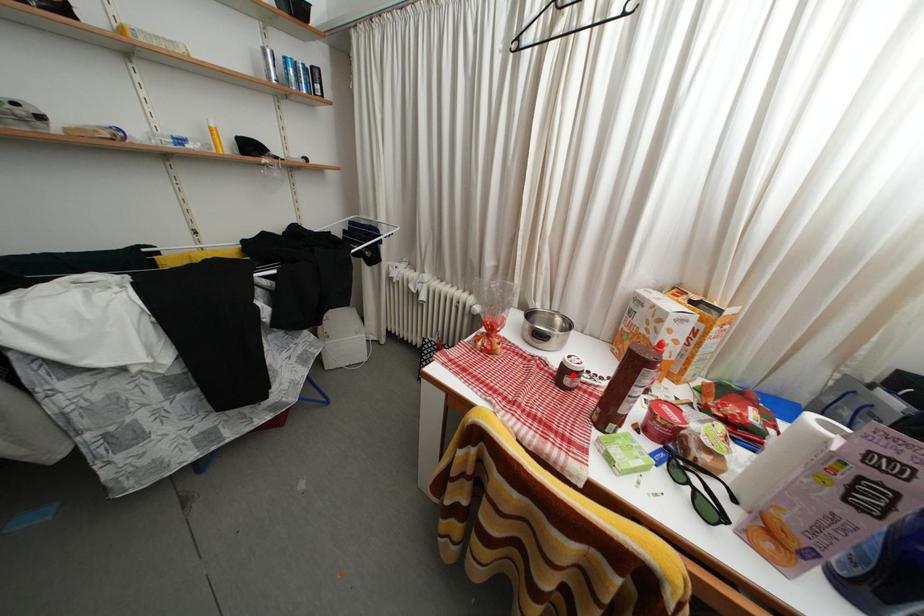
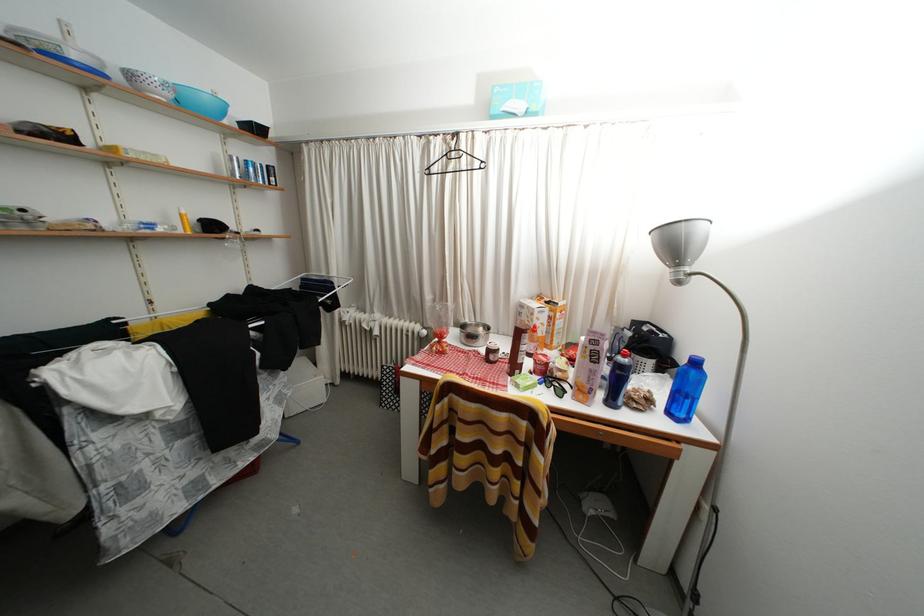
Where in the second image is the point corresponding to the highlighted location from the first image?

(496, 357)